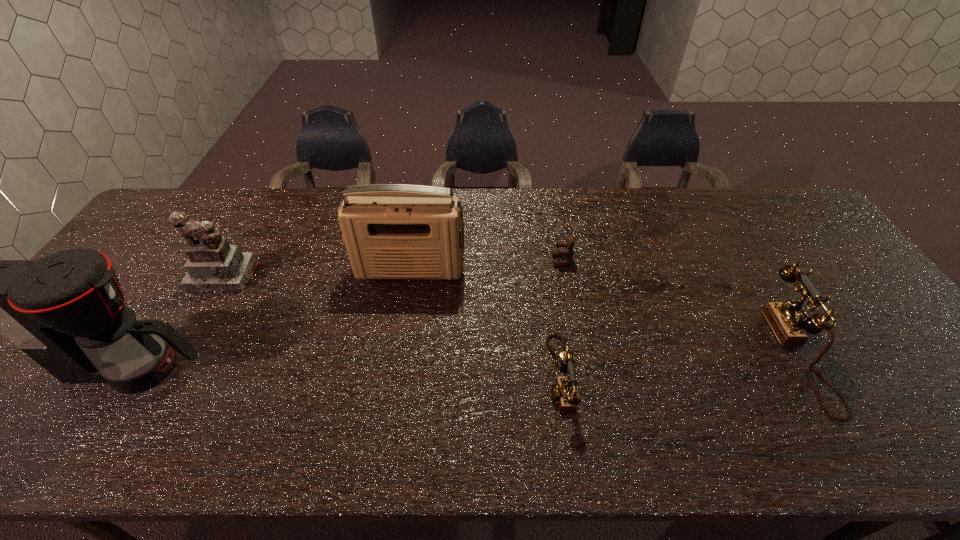
I want to click on vacant space that is in between the figurine and the right telephone, so click(513, 315).

The image size is (960, 540). Find the location of `vacant region between the coffee maker and the shortest object`. vacant region between the coffee maker and the shortest object is located at coordinates (349, 314).

Find the location of a particular element. This screenshot has width=960, height=540. free point between the left telephone and the taller telephone is located at coordinates click(x=680, y=365).

This screenshot has width=960, height=540. I want to click on vacant space in between the third tallest object and the coffee maker, so click(x=180, y=321).

Identify the location of free area in between the fifth tallest object and the fifth object from left to right. (561, 318).

At what (x,y) coordinates should I click in order to perform the action: click on object that is the second closest to the fourth shortest object. Please return your answer as a coordinate pair (x, y). The image size is (960, 540). Looking at the image, I should click on (391, 231).

Identify which object is the nearest to the second object from right to left. Please provide its 2D coordinates. Your answer should be formatted as a tuple, i.e. [(x, y)], where the tuple contains the x and y coordinates of a point satisfying the conditions above.

[(563, 389)]

The image size is (960, 540). In order to click on vacant point that satisfies the following two spatial constraints: 1. on the face of the shortest object; 2. on the front-facing side of the figurine in this screenshot , I will do `click(565, 275)`.

At what (x,y) coordinates should I click in order to perform the action: click on vacant point that satisfies the following two spatial constraints: 1. on the face of the fifth object from left to right; 2. on the front-facing side of the third object from left to right. Please return your answer as a coordinate pair (x, y). Looking at the image, I should click on (564, 271).

This screenshot has width=960, height=540. Find the location of `free location that satisfies the following two spatial constraints: 1. on the front-facing side of the radio receiver; 2. pour from the carafe of the coffee maker`. free location that satisfies the following two spatial constraints: 1. on the front-facing side of the radio receiver; 2. pour from the carafe of the coffee maker is located at coordinates (395, 367).